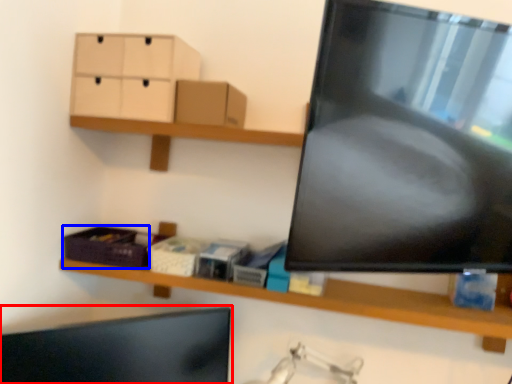
Question: Which point is closer to the camera, computer monitor (highlighted by a red box) or storage box (highlighted by a blue box)?

Choices:
 (A) computer monitor
 (B) storage box

Answer: (A)